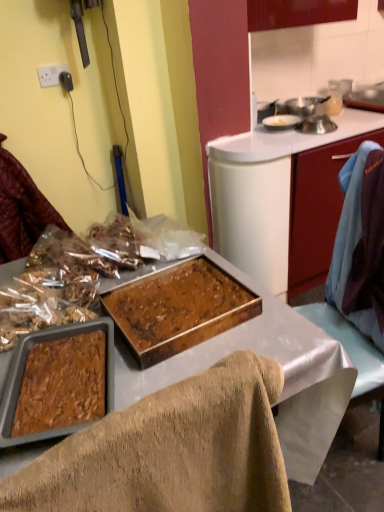
Question: Considering the relative positions of shiny plastic bag of nuts at left and brown textured tray at center in the image provided, is shiny plastic bag of nuts at left to the left of brown textured tray at center from the viewer's perspective?

Choices:
 (A) no
 (B) yes

Answer: (B)

Question: Can you confirm if shiny plastic bag of nuts at left is positioned to the right of brown textured tray at center?

Choices:
 (A) no
 (B) yes

Answer: (A)

Question: Does shiny plastic bag of nuts at left lie behind brown textured tray at center?

Choices:
 (A) no
 (B) yes

Answer: (B)

Question: From the image's perspective, is shiny plastic bag of nuts at left located beneath brown textured tray at center?

Choices:
 (A) no
 (B) yes

Answer: (A)

Question: Can you confirm if shiny plastic bag of nuts at left is shorter than brown textured tray at center?

Choices:
 (A) yes
 (B) no

Answer: (A)

Question: Considering the relative sizes of shiny plastic bag of nuts at left and brown textured tray at center in the image provided, is shiny plastic bag of nuts at left bigger than brown textured tray at center?

Choices:
 (A) no
 (B) yes

Answer: (A)

Question: Is white plastic power outlet at upper left far from shiny plastic bag of nuts at left?

Choices:
 (A) no
 (B) yes

Answer: (A)

Question: Does white plastic power outlet at upper left appear on the left side of shiny plastic bag of nuts at left?

Choices:
 (A) yes
 (B) no

Answer: (B)

Question: Is white plastic power outlet at upper left wider than shiny plastic bag of nuts at left?

Choices:
 (A) yes
 (B) no

Answer: (B)

Question: Is white plastic power outlet at upper left facing away from shiny plastic bag of nuts at left?

Choices:
 (A) no
 (B) yes

Answer: (A)

Question: Is white plastic power outlet at upper left oriented towards shiny plastic bag of nuts at left?

Choices:
 (A) no
 (B) yes

Answer: (A)

Question: Is white plastic power outlet at upper left taller than shiny plastic bag of nuts at left?

Choices:
 (A) yes
 (B) no

Answer: (B)

Question: Is metallic silver pot at upper right facing towards brown crumbly mixture at left, the 2th food in the front-to-back sequence?

Choices:
 (A) yes
 (B) no

Answer: (B)